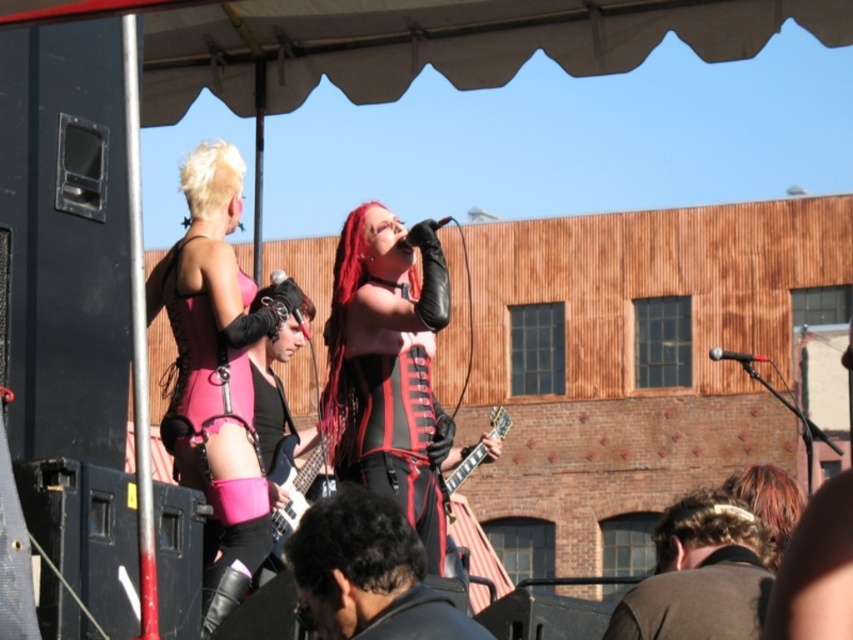
You are a photographer setting up for the live performance. You need to decide which item, the pink matte corset at upper left or the black leather jacket at lower center, requires a wider lens focus area. Based on their sizes, which one should you adjust your camera settings for?

The pink matte corset at upper left requires a wider lens focus area because its width is larger than the black leather jacket at lower center.

You are a photographer standing at the camera position. You want to capture a closeup shot of the pink matte corset at upper left. Given that your camera can focus on objects within 150 feet, will you be able to capture the corset clearly?

The pink matte corset at upper left is 170.02 feet away from the camera, which is beyond the camera focus range of 150 feet. Therefore, you won need to move closer to capture it clearly.